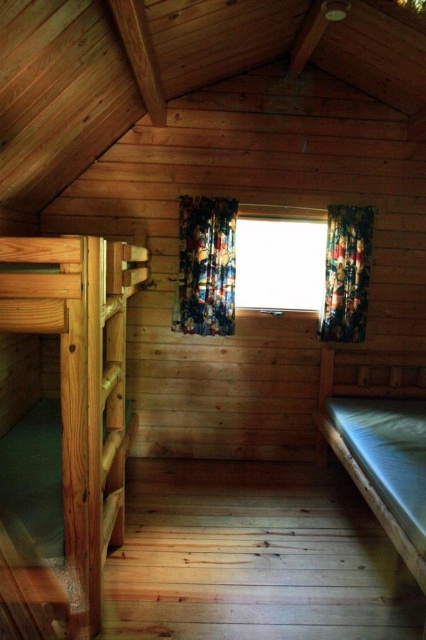
You are standing inside the rustic wooden cabin and want to sleep in the white fabric bed at right. To reach it, you need to walk past the multicolored fabric curtain at center. Is the bed below or above the curtain?

The white fabric bed at right is located below the multicolored fabric curtain at center, so the bed is below the curtain.

You are inside the rustic wooden cabin and want to sleep in the bed. Which direction should you walk from the transparent glass window at center to reach the white fabric bed at right?

You should walk to the right from the transparent glass window at center to reach the white fabric bed at right since it is positioned to the right of the window.